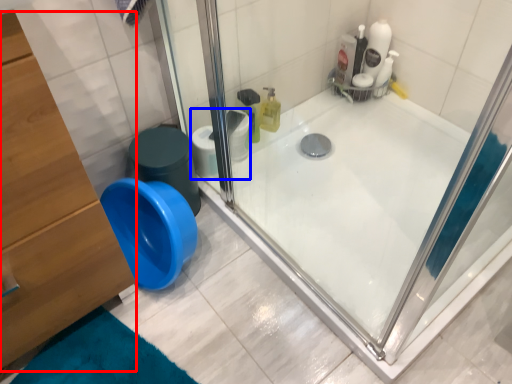
Question: Which object is closer to the camera taking this photo, dresser (highlighted by a red box) or toilet paper (highlighted by a blue box)?

Choices:
 (A) dresser
 (B) toilet paper

Answer: (A)